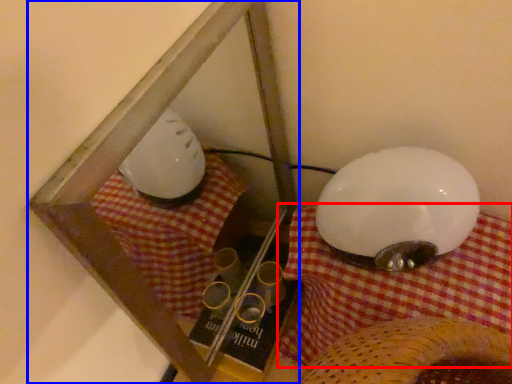
Question: Which object appears farthest to the camera in this image, blanket (highlighted by a red box) or glass box (highlighted by a blue box)?

Choices:
 (A) blanket
 (B) glass box

Answer: (B)